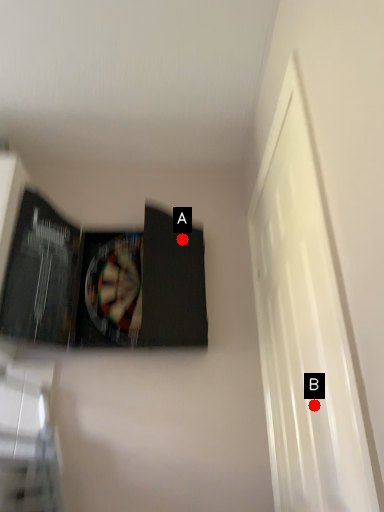
Question: Two points are circled on the image, labeled by A and B beside each circle. Which point appears farthest from the camera in this image?

Choices:
 (A) A is further
 (B) B is further

Answer: (A)